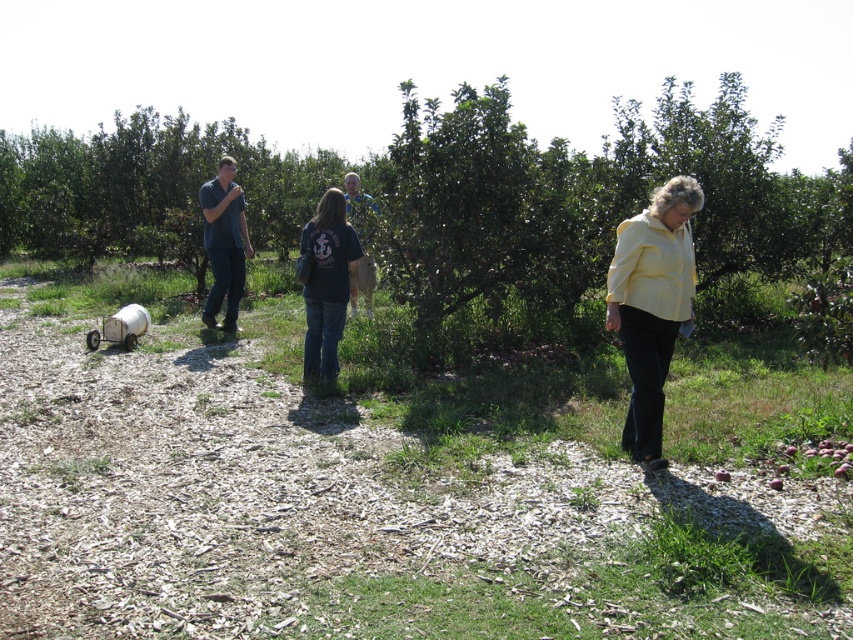
Question: Can you confirm if black cotton shirt at center is bigger than blue denim jeans at left?

Choices:
 (A) no
 (B) yes

Answer: (A)

Question: Which object appears closest to the camera in this image?

Choices:
 (A) blue denim jacket at center
 (B) blue denim jeans at left
 (C) yellow matte shirt at center
 (D) green leafy tree at center

Answer: (C)

Question: Is green leafy tree at center to the right of yellow matte shirt at center from the viewer's perspective?

Choices:
 (A) yes
 (B) no

Answer: (A)

Question: Among these points, which one is farthest from the camera?

Choices:
 (A) (370, 282)
 (B) (735, 81)
 (C) (688, 314)
 (D) (311, 356)

Answer: (B)

Question: Is black cotton shirt at center to the right of blue denim jacket at center from the viewer's perspective?

Choices:
 (A) yes
 (B) no

Answer: (A)

Question: Which object is positioned closest to the yellow matte shirt at center?

Choices:
 (A) green leafy tree at center
 (B) blue denim jacket at center
 (C) black cotton shirt at center
 (D) blue denim jeans at left

Answer: (C)